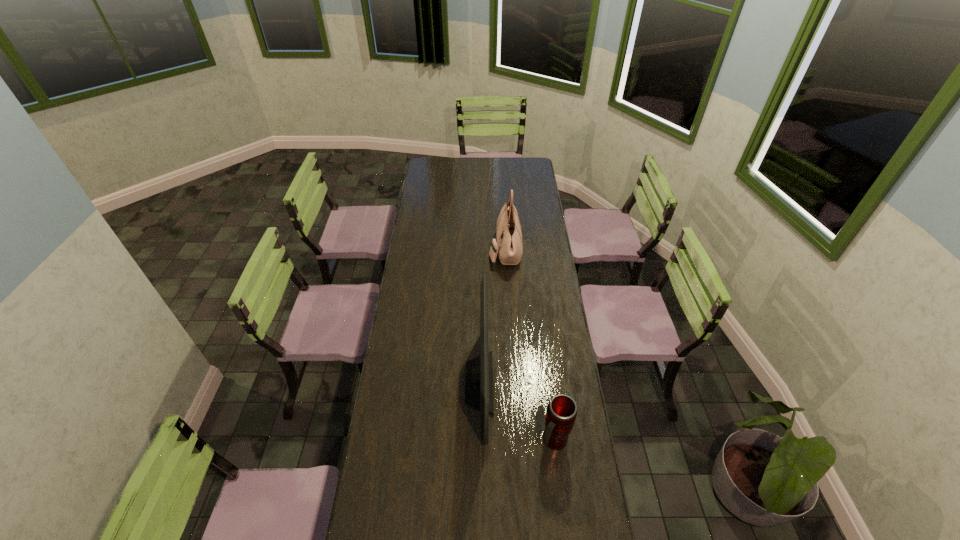
Where is `vacant space at the far edge of the desktop`? vacant space at the far edge of the desktop is located at coordinates (466, 160).

Find the location of `vacant space at the left edge`. vacant space at the left edge is located at coordinates (401, 503).

The width and height of the screenshot is (960, 540). I want to click on vacant space at the right edge of the desktop, so click(x=540, y=450).

In the image, there is a desktop. Where is `vacant area at the far left corner`? The height and width of the screenshot is (540, 960). vacant area at the far left corner is located at coordinates (424, 168).

Locate an element on the screen. This screenshot has height=540, width=960. empty space between the handbag and the shortest object is located at coordinates (530, 345).

You are a GUI agent. You are given a task and a screenshot of the screen. Output one action in this format:
    pyautogui.click(x=<x>, y=<y>)
    Task: Click on the empty location between the farthest object and the monitor
    The width and height of the screenshot is (960, 540).
    Given the screenshot: What is the action you would take?
    pyautogui.click(x=492, y=315)

The height and width of the screenshot is (540, 960). I want to click on free space between the handbag and the shortest object, so tap(530, 345).

Identify the location of unoccupied area between the monitor and the shortest object. (516, 411).

You are a GUI agent. You are given a task and a screenshot of the screen. Output one action in this format:
    pyautogui.click(x=<x>, y=<y>)
    Task: Click on the vacant space that's between the monitor and the shortest object
    
    Given the screenshot: What is the action you would take?
    pyautogui.click(x=516, y=411)

Locate which object is the second closest to the monitor. Please provide its 2D coordinates. Your answer should be formatted as a tuple, i.e. [(x, y)], where the tuple contains the x and y coordinates of a point satisfying the conditions above.

[(509, 246)]